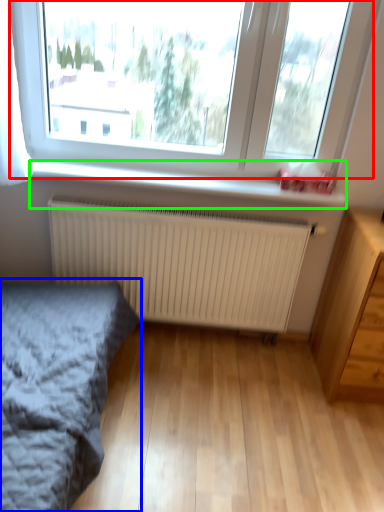
Question: Which is farther away from window (highlighted by a red box)? bed (highlighted by a blue box) or window sill (highlighted by a green box)?

Choices:
 (A) bed
 (B) window sill

Answer: (A)